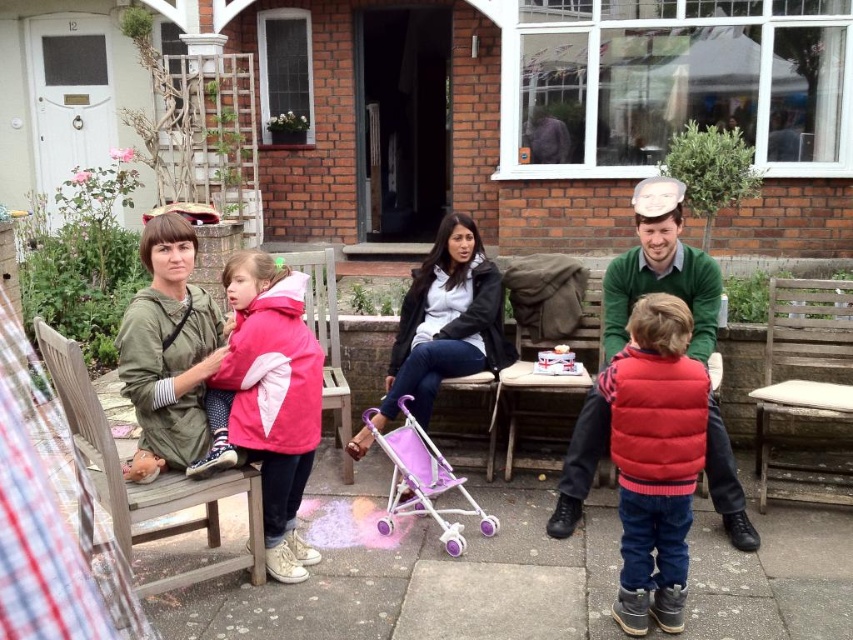
You are organizing a small outdoor event and need to arrange seating for guests. You have a green sweater at center and a pink plastic stroller at center. Which object should you prioritize placing first to accommodate both items comfortably?

The green sweater at center has a larger size compared to the pink plastic stroller at center, so you should prioritize placing the green sweater at center first to ensure there is enough space for both items.

In the scene shown: You have a 1.5 meter long wooden bench that you want to place in your garden. You see the wooden bench at left and the weathered wood chair at right in the image. Which object in the image has a greater width?

The wooden bench at left has a greater width than the weathered wood chair at right.